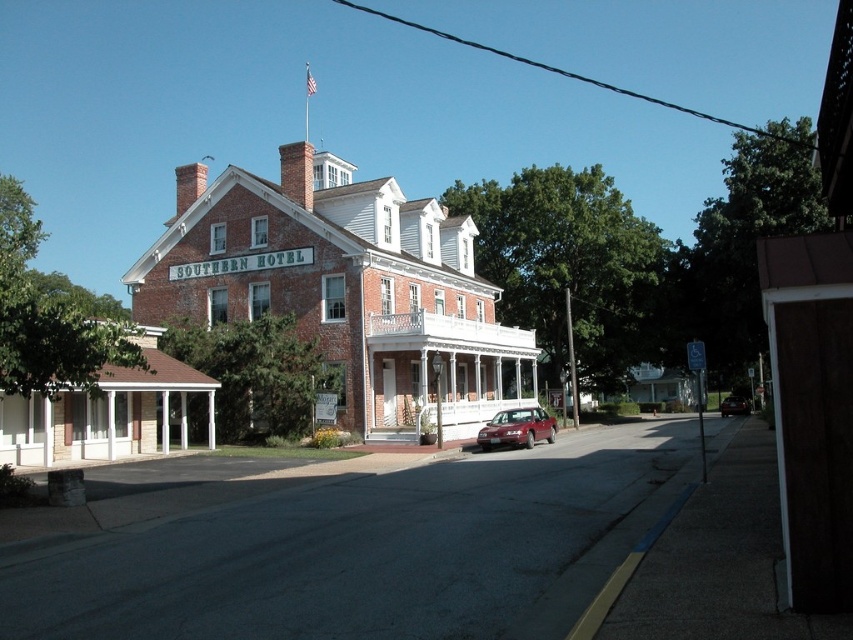
Who is taller, white wooden porch at center or shiny red sedan at center?

white wooden porch at center is taller.

Is white wooden porch at center bigger than shiny red sedan at center?

Correct, white wooden porch at center is larger in size than shiny red sedan at center.

Is point (422, 381) closer to camera compared to point (746, 410)?

Yes.

Image resolution: width=853 pixels, height=640 pixels. I want to click on white wooden porch at center, so click(445, 371).

Which is above, shiny maroon sedan at center or shiny red sedan at center?

Positioned higher is shiny maroon sedan at center.

Between point (517, 429) and point (723, 410), which one is positioned in front?

Point (517, 429) is more forward.

This screenshot has height=640, width=853. I want to click on shiny maroon sedan at center, so click(515, 428).

Is white wooden porch at center below shiny maroon sedan at center?

No.

Who is shorter, white wooden porch at center or shiny maroon sedan at center?

shiny maroon sedan at center

Is point (422, 364) more distant than point (529, 438)?

Yes, it is.

This screenshot has height=640, width=853. I want to click on white wooden porch at center, so click(x=445, y=371).